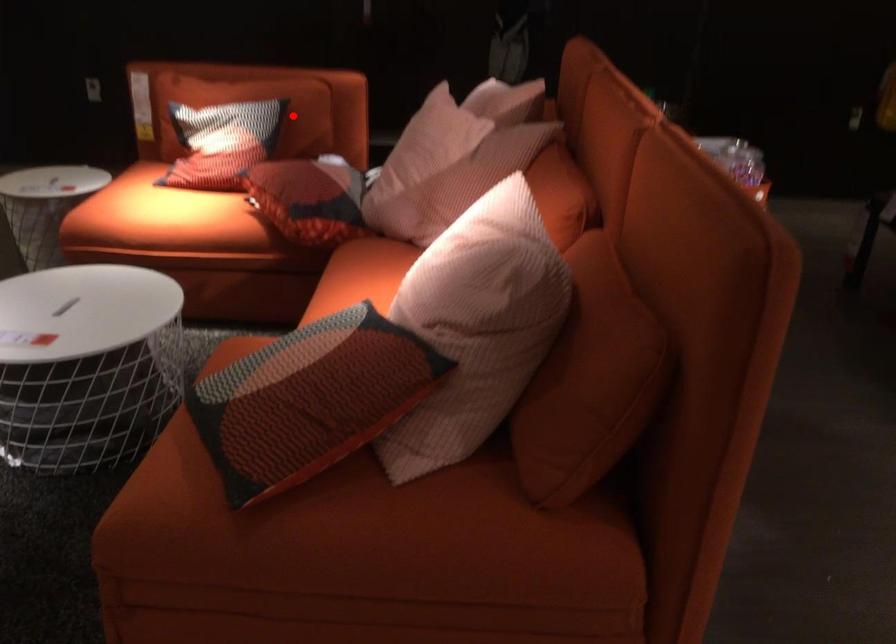
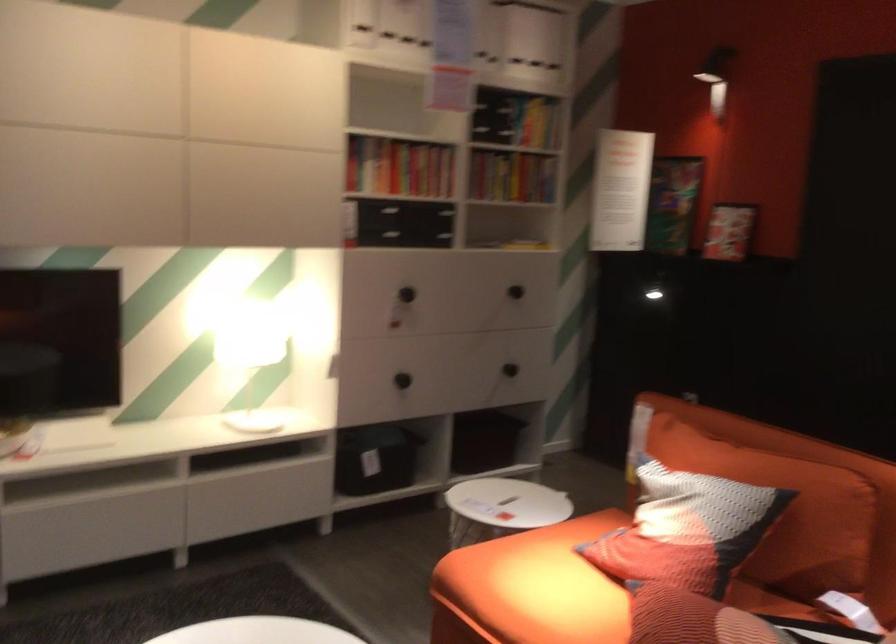
Question: I am providing you with two images of the same scene from different viewpoints. In image1, a red point is highlighted. Considering the same 3D point in image2, which of the following is correct?

Choices:
 (A) It is closer
 (B) It is farther

Answer: (A)